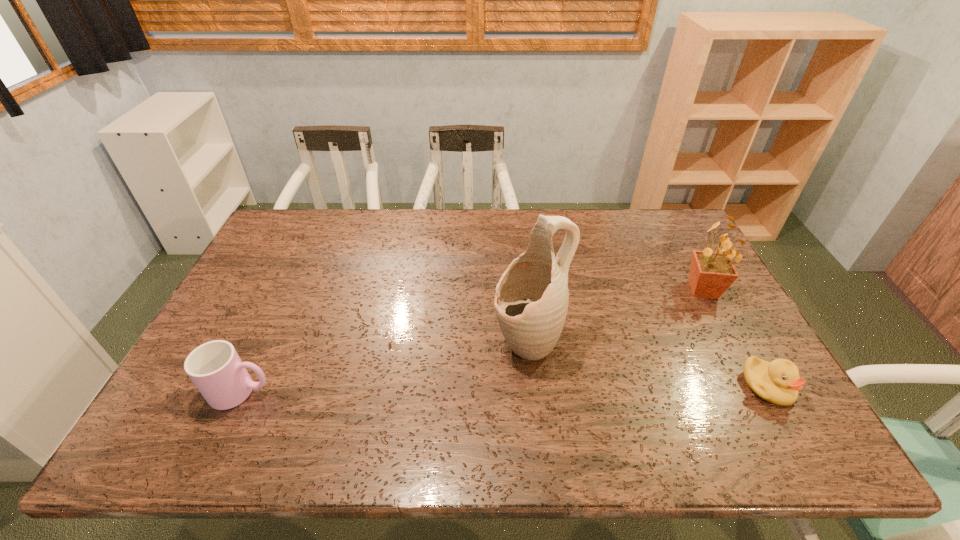
I want to click on object that is at the near right corner, so click(778, 382).

Locate an element on the screen. The width and height of the screenshot is (960, 540). vacant space at the far edge is located at coordinates (426, 222).

This screenshot has height=540, width=960. In the image, there is a desktop. In order to click on vacant space at the near edge in this screenshot , I will do `click(555, 405)`.

Where is `free space at the left edge of the desktop`? free space at the left edge of the desktop is located at coordinates (285, 261).

Find the location of a particular element. Image resolution: width=960 pixels, height=540 pixels. vacant area at the right edge of the desktop is located at coordinates (666, 263).

The height and width of the screenshot is (540, 960). What are the coordinates of `free space at the far left corner` in the screenshot? It's located at (297, 211).

Locate an element on the screen. The image size is (960, 540). vacant area at the far right corner of the desktop is located at coordinates 668,232.

Locate an element on the screen. free space between the shortest object and the farthest object is located at coordinates (735, 339).

Locate an element on the screen. The image size is (960, 540). empty location between the shortest object and the cup is located at coordinates (504, 389).

You are a GUI agent. You are given a task and a screenshot of the screen. Output one action in this format:
    pyautogui.click(x=<x>, y=<y>)
    Task: Click on the blank region between the pitcher and the third tallest object
    
    Given the screenshot: What is the action you would take?
    pyautogui.click(x=385, y=367)